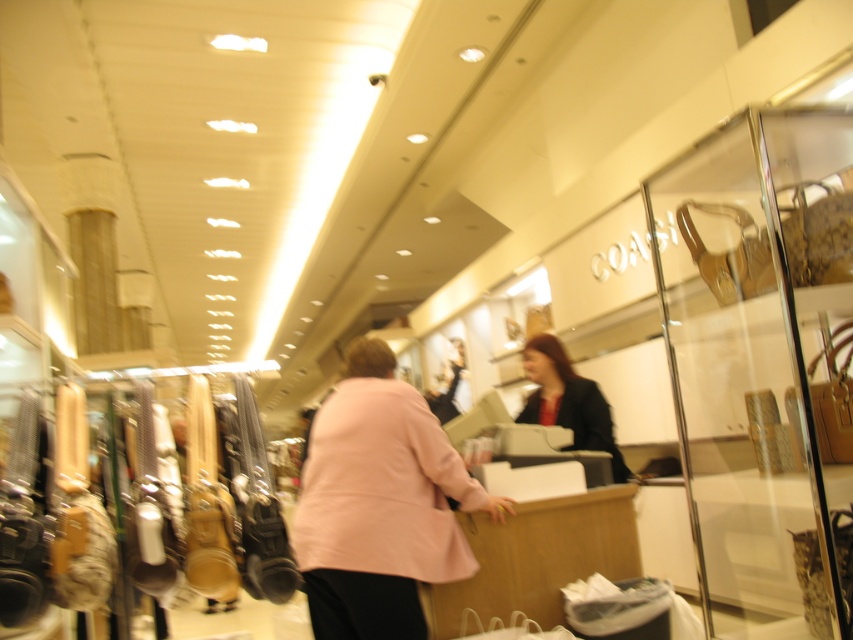
Does pink fabric coat at center appear over dark blue fabric jacket at center?

Incorrect, pink fabric coat at center is not positioned above dark blue fabric jacket at center.

Who is higher up, pink fabric coat at center or dark blue fabric jacket at center?

dark blue fabric jacket at center

Between point (354, 371) and point (608, 417), which one is positioned in front?

Point (354, 371) is in front.

In order to click on pink fabric coat at center in this screenshot , I will do `click(379, 504)`.